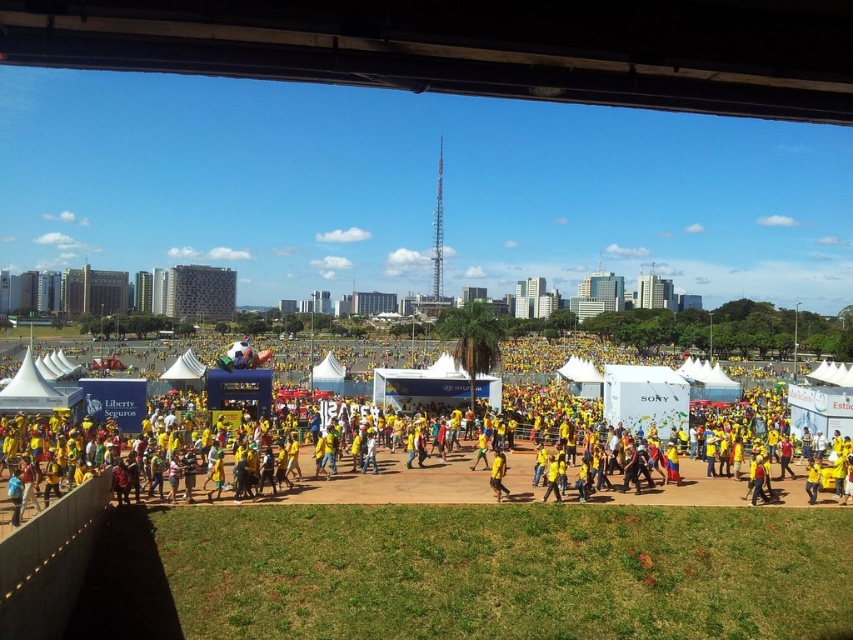
Question: Which object appears closest to the camera in this image?

Choices:
 (A) yellow fabric person at center
 (B) yellow matte shirt at center

Answer: (A)

Question: Is yellow fabric person at center thinner than yellow matte shirt at center?

Choices:
 (A) no
 (B) yes

Answer: (A)

Question: Is yellow fabric person at center below yellow matte shirt at center?

Choices:
 (A) yes
 (B) no

Answer: (B)

Question: Where is yellow fabric person at center located in relation to yellow matte shirt at center in the image?

Choices:
 (A) left
 (B) right

Answer: (A)

Question: Which point appears closest to the camera in this image?

Choices:
 (A) (497, 492)
 (B) (103, 381)

Answer: (A)